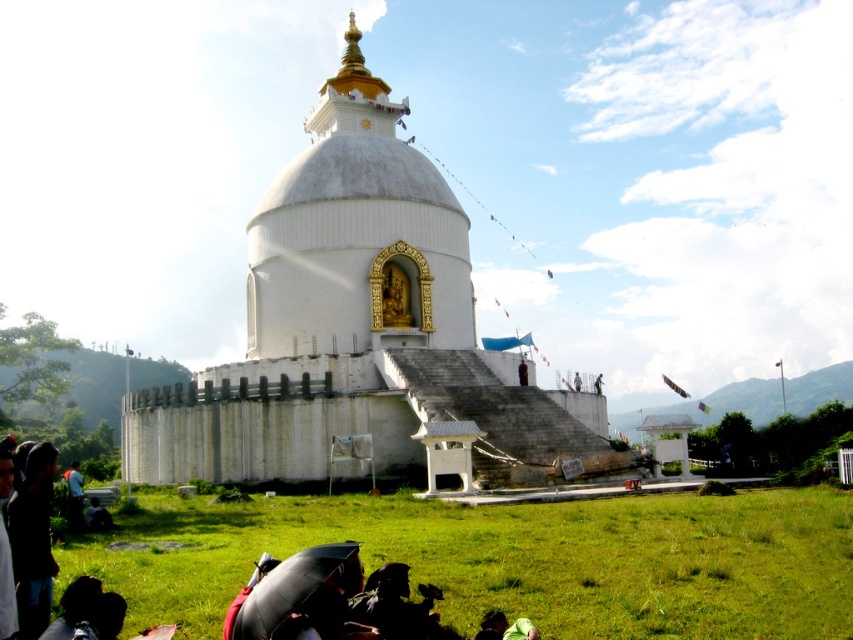
You are standing at the dark blue jeans at lower left and want to reach the white stone stupa at center. The path is straight but has a slight incline. If your average walking speed is 1.5 meters per second, how many seconds will it take you to reach the stupa?

The distance between the white stone stupa at center and dark blue jeans at lower left is 40.73 meters. At a speed of 1.5 meters per second, it would take approximately 27.15 seconds to reach the stupa.

You are a visitor planning to take a photo of the white stone stupa at center and the green grass at lower center. Which object should you focus on first if you want to capture both in a single frame without moving the camera, considering their sizes?

The white stone stupa at center has a lesser width compared to green grass at lower center. To capture both in a single frame without moving the camera, focus on the larger object first, which is the green grass at lower center, as it occupies more space in the frame.

You are standing at the base of the white stone stupa at center and want to take a photo of the dark blue jeans at lower left. Which direction should you move to frame both the stupa and the jeans in your camera viewfinder?

You should move to the left of the white stone stupa at center to include the dark blue jeans at lower left in your photo, as the stupa is positioned to the right of the jeans.